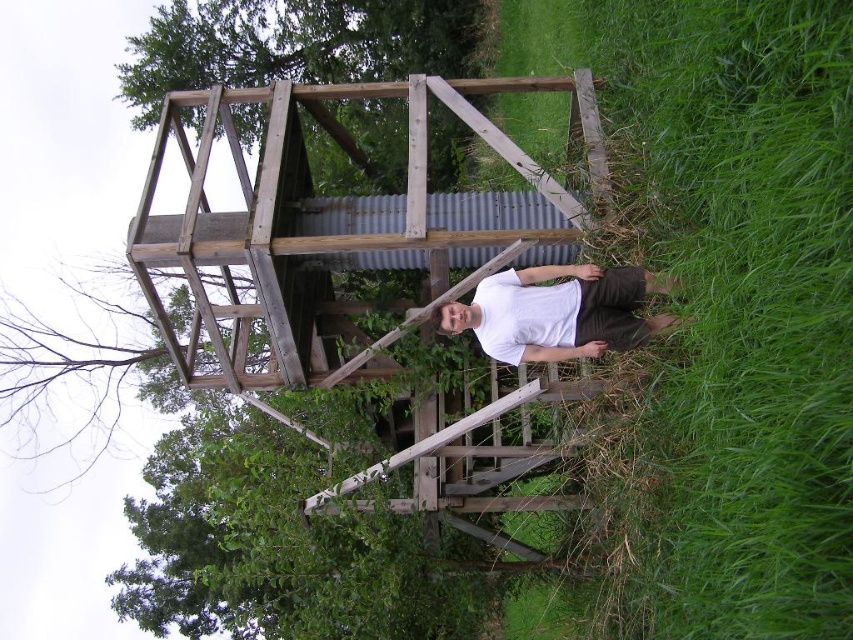
What are the coordinates of `wooden frame at center` in the screenshot? It's located at (341, 227).

Is wooden frame at center wider than white matte shirt at center?

No.

Locate an element on the screen. wooden frame at center is located at coordinates (341, 227).

Is point (450, 60) behind point (518, 291)?

Yes, it is behind point (518, 291).

Can you confirm if brown wooden structure at upper center is thinner than white matte shirt at center?

In fact, brown wooden structure at upper center might be wider than white matte shirt at center.

In the scene shown: Measure the distance between brown wooden structure at upper center and camera.

brown wooden structure at upper center and camera are 9.30 meters apart from each other.

The width and height of the screenshot is (853, 640). Identify the location of brown wooden structure at upper center. point(297,44).

Is point (379, 236) positioned behind point (144, 128)?

No.

Which is behind, point (473, 81) or point (143, 92)?

The point (143, 92) is more distant.

Where is `wooden frame at center`? The height and width of the screenshot is (640, 853). wooden frame at center is located at coordinates (341, 227).